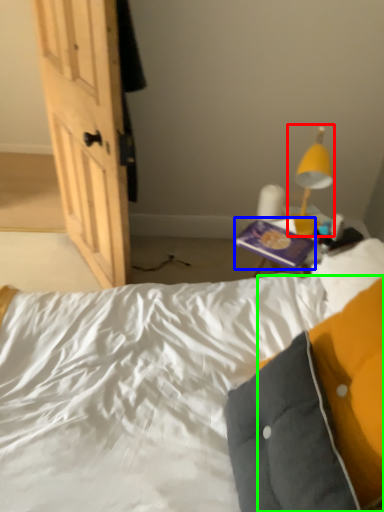
Question: Which object is the closest to the lamp (highlighted by a red box)? Choose among these: paperback book (highlighted by a blue box) or pillow (highlighted by a green box).

Choices:
 (A) paperback book
 (B) pillow

Answer: (A)